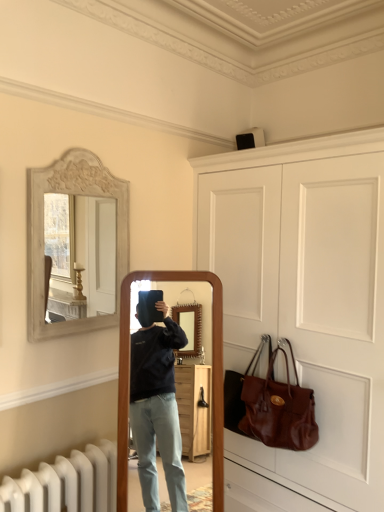
Question: Is white matte door at upper center positioned before white carved wood mirror at upper left?

Choices:
 (A) yes
 (B) no

Answer: (A)

Question: Can you confirm if white matte door at upper center is taller than white carved wood mirror at upper left?

Choices:
 (A) no
 (B) yes

Answer: (B)

Question: Could you tell me if white matte door at upper center is facing white carved wood mirror at upper left?

Choices:
 (A) no
 (B) yes

Answer: (B)

Question: Is white matte door at upper center wider than white carved wood mirror at upper left?

Choices:
 (A) no
 (B) yes

Answer: (B)

Question: Can we say white matte door at upper center lies outside white carved wood mirror at upper left?

Choices:
 (A) yes
 (B) no

Answer: (A)

Question: Looking at the image, does white carved wood mirror at upper left seem bigger or smaller compared to brown leather handbag at lower right?

Choices:
 (A) small
 (B) big

Answer: (A)

Question: Is point (49, 337) positioned closer to the camera than point (296, 449)?

Choices:
 (A) farther
 (B) closer

Answer: (B)

Question: From the image's perspective, is white carved wood mirror at upper left located above or below brown leather handbag at lower right?

Choices:
 (A) above
 (B) below

Answer: (A)

Question: Is white carved wood mirror at upper left wider or thinner than brown leather handbag at lower right?

Choices:
 (A) wide
 (B) thin

Answer: (B)

Question: Considering the positions of white carved wood mirror at upper left and white matte door at upper center in the image, is white carved wood mirror at upper left wider or thinner than white matte door at upper center?

Choices:
 (A) wide
 (B) thin

Answer: (B)

Question: Considering the relative positions of white carved wood mirror at upper left and white matte door at upper center in the image provided, is white carved wood mirror at upper left to the left or to the right of white matte door at upper center?

Choices:
 (A) right
 (B) left

Answer: (B)

Question: Is white carved wood mirror at upper left situated inside white matte door at upper center or outside?

Choices:
 (A) outside
 (B) inside

Answer: (A)

Question: Is point (74, 193) closer or farther from the camera than point (380, 153)?

Choices:
 (A) farther
 (B) closer

Answer: (A)

Question: Is point pyautogui.click(x=244, y=424) positioned closer to the camera than point pyautogui.click(x=327, y=164)?

Choices:
 (A) closer
 (B) farther

Answer: (B)

Question: Looking at the image, does brown leather handbag at lower right seem bigger or smaller compared to white matte door at upper center?

Choices:
 (A) small
 (B) big

Answer: (A)